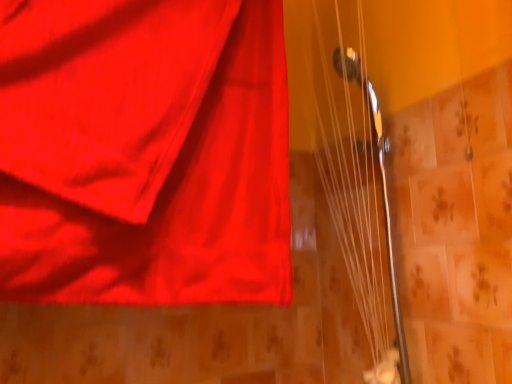
Question: Considering the relative sizes of metallic silver strings at upper right and matte red curtain at upper left in the image provided, is metallic silver strings at upper right smaller than matte red curtain at upper left?

Choices:
 (A) yes
 (B) no

Answer: (A)

Question: From a real-world perspective, is metallic silver strings at upper right beneath matte red curtain at upper left?

Choices:
 (A) yes
 (B) no

Answer: (A)

Question: From a real-world perspective, is metallic silver strings at upper right on top of matte red curtain at upper left?

Choices:
 (A) yes
 (B) no

Answer: (B)

Question: Considering the relative sizes of metallic silver strings at upper right and matte red curtain at upper left in the image provided, is metallic silver strings at upper right bigger than matte red curtain at upper left?

Choices:
 (A) no
 (B) yes

Answer: (A)

Question: Can you confirm if metallic silver strings at upper right is positioned to the right of matte red curtain at upper left?

Choices:
 (A) yes
 (B) no

Answer: (A)

Question: Is metallic silver strings at upper right not inside matte red curtain at upper left?

Choices:
 (A) yes
 (B) no

Answer: (A)

Question: Does matte red curtain at upper left have a lesser height compared to metallic silver strings at upper right?

Choices:
 (A) no
 (B) yes

Answer: (B)

Question: From the image's perspective, is matte red curtain at upper left located above metallic silver strings at upper right?

Choices:
 (A) yes
 (B) no

Answer: (A)

Question: Would you say matte red curtain at upper left is a long distance from metallic silver strings at upper right?

Choices:
 (A) yes
 (B) no

Answer: (B)

Question: Does matte red curtain at upper left appear on the right side of metallic silver strings at upper right?

Choices:
 (A) yes
 (B) no

Answer: (B)

Question: Is matte red curtain at upper left not inside metallic silver strings at upper right?

Choices:
 (A) no
 (B) yes

Answer: (B)

Question: Can you confirm if matte red curtain at upper left is wider than metallic silver strings at upper right?

Choices:
 (A) no
 (B) yes

Answer: (B)

Question: Is matte red curtain at upper left wider or thinner than metallic silver strings at upper right?

Choices:
 (A) wide
 (B) thin

Answer: (A)